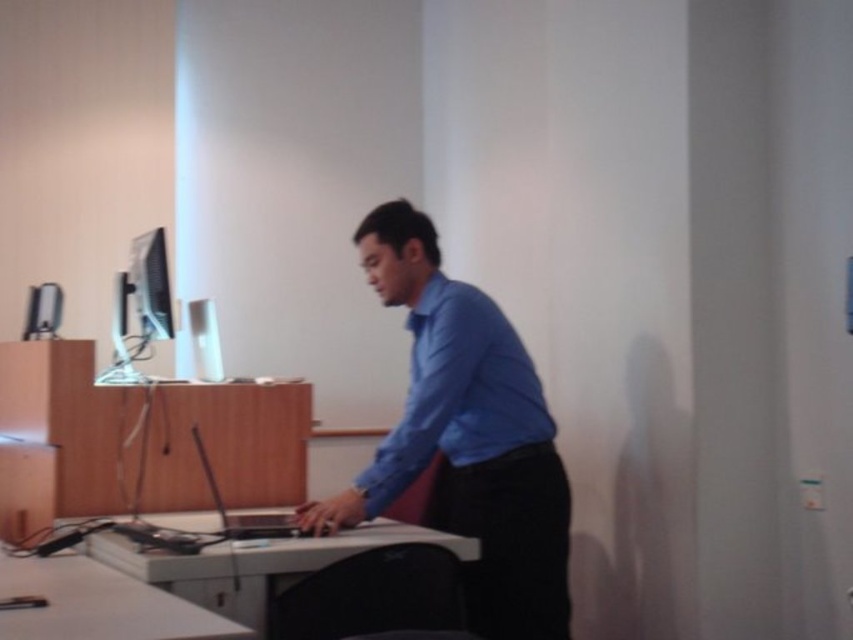
You are an office assistant trying to determine which clothing item is visible first when looking at the person. Which one is in front, the blue smooth shirt at center or the blue smooth dress shirt at center?

The blue smooth shirt at center is in front of the blue smooth dress shirt at center, so it is the one that is visible first.

You are standing in the office scene described. There is a point labeled at coordinates (x=140, y=307). What object is located at that point?

The point at coordinates (x=140, y=307) corresponds to the matte black monitor at left.